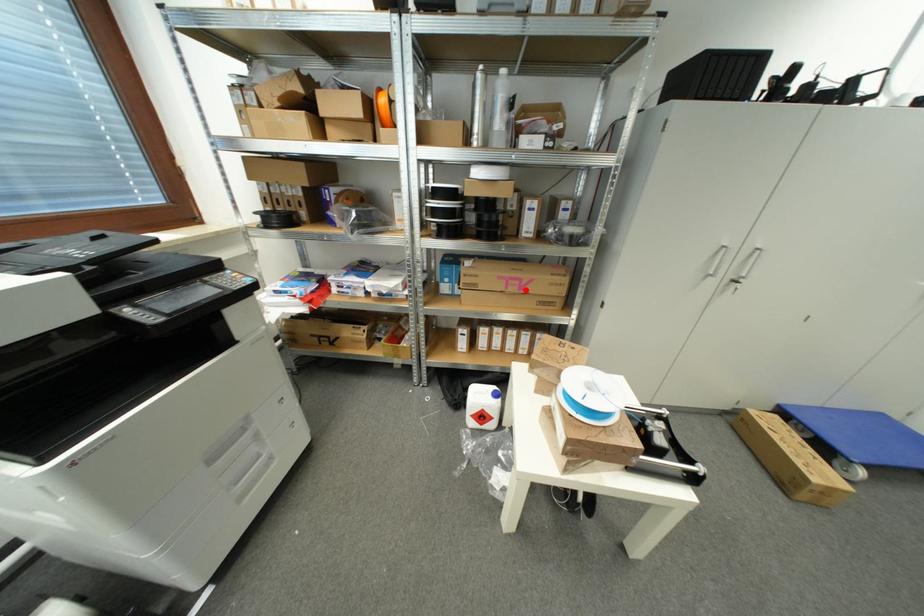
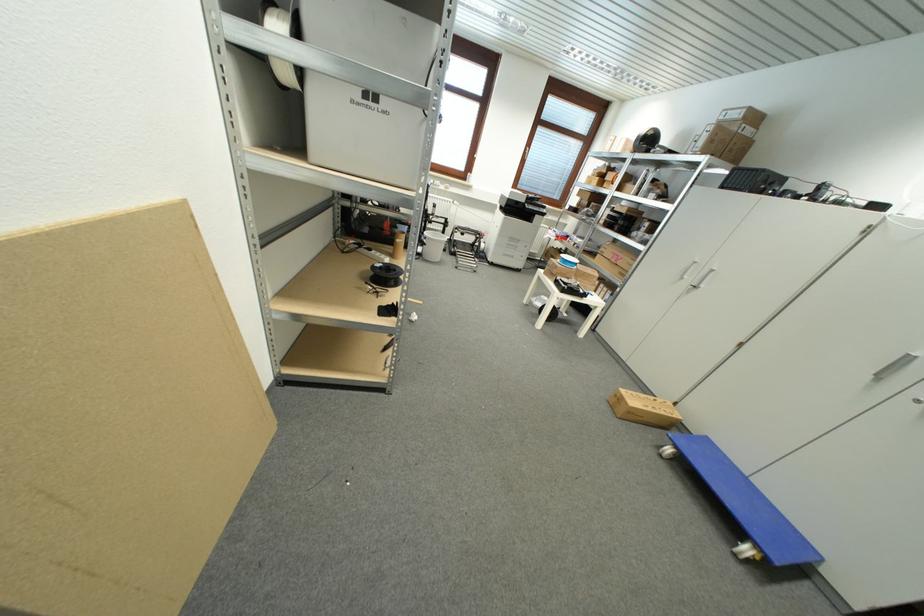
Question: I am providing you with two images of the same scene from different viewpoints. In image1, a red point is highlighted. Considering the same 3D point in image2, which of the following is correct?

Choices:
 (A) It is closer
 (B) It is farther

Answer: (A)